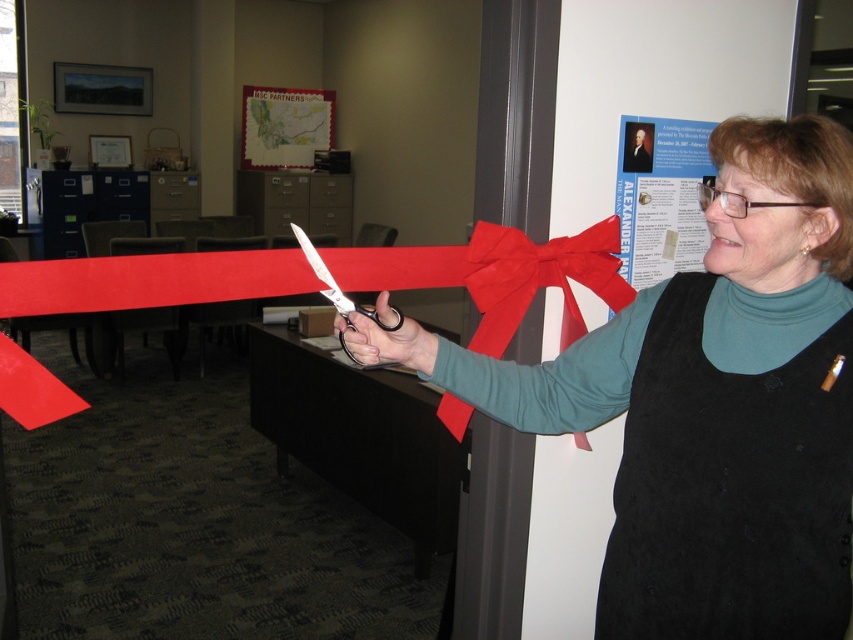
You are standing at the point marked by the coordinates point [840,481]. You want to move forward 40 inches. Will you hit any obstacles in the scene?

The distance between point [840,481] and the viewer is 38.08 inches. Moving forward 40 inches would exceed this distance, so you would hit an obstacle.

You are standing in the ribbon cutting ceremony scene. There are two points marked in the image. The first point is at coordinate point (740, 413) and the second point is at coordinate point (573, 237). Which point is closer to you?

Point (740, 413) is closer to the viewer than point (573, 237).